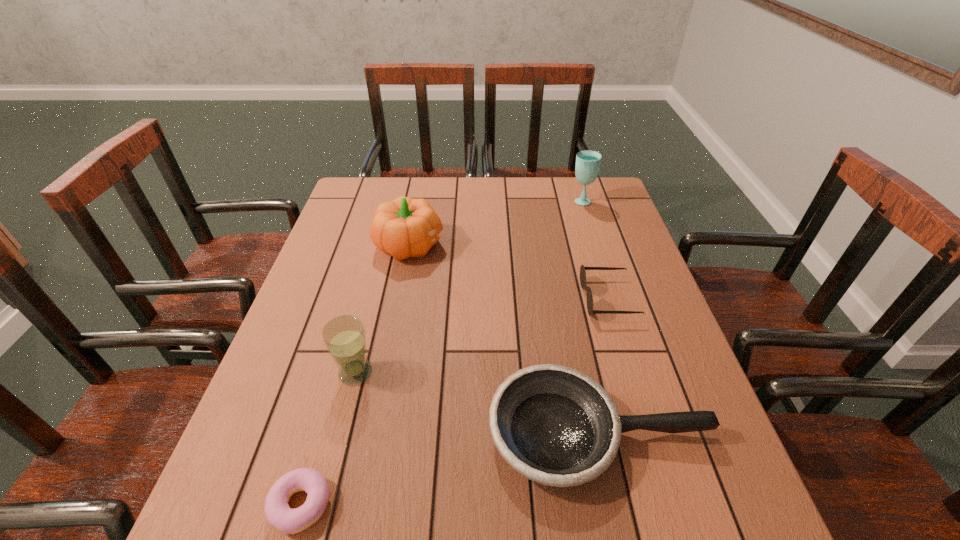
Locate an element on the screen. vacant space situated on the right of the left glass is located at coordinates (548, 372).

Find the location of a particular element. The image size is (960, 540). vacant space located on the front-facing side of the sunglasses is located at coordinates (446, 299).

I want to click on vacant space positioned on the front-facing side of the sunglasses, so click(x=509, y=299).

Image resolution: width=960 pixels, height=540 pixels. I want to click on vacant space situated on the front-facing side of the sunglasses, so click(533, 299).

This screenshot has width=960, height=540. What are the coordinates of `free space located 0.050m on the left of the shortest object` in the screenshot? It's located at (242, 505).

I want to click on object present at the far edge, so click(588, 162).

Identify the location of object at the near edge. The height and width of the screenshot is (540, 960). (278, 513).

You are a GUI agent. You are given a task and a screenshot of the screen. Output one action in this format:
    pyautogui.click(x=<x>, y=<y>)
    Task: Click on the pumpkin located in the left edge section of the desktop
    This screenshot has height=540, width=960.
    Given the screenshot: What is the action you would take?
    pyautogui.click(x=405, y=227)

Find the location of a particular element. The image size is (960, 540). glass at the left edge is located at coordinates (344, 336).

Where is `doughnut located at the left edge`? This screenshot has height=540, width=960. doughnut located at the left edge is located at coordinates (278, 513).